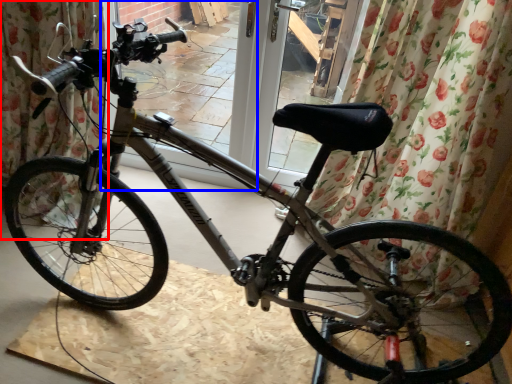
Question: Which point is further to the camera, curtain (highlighted by a red box) or screen door (highlighted by a blue box)?

Choices:
 (A) curtain
 (B) screen door

Answer: (B)